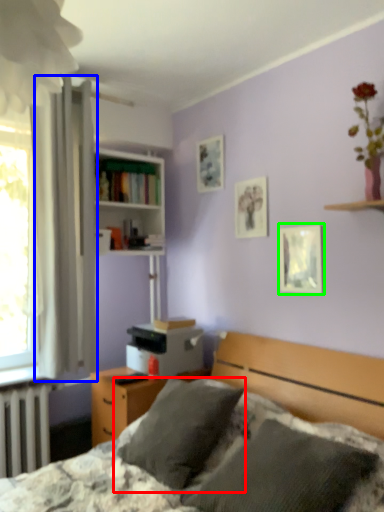
Question: Estimate the real-world distances between objects in this image. Which object is farther from pillow (highlighted by a red box), curtain (highlighted by a blue box) or picture frame (highlighted by a green box)?

Choices:
 (A) curtain
 (B) picture frame

Answer: (A)